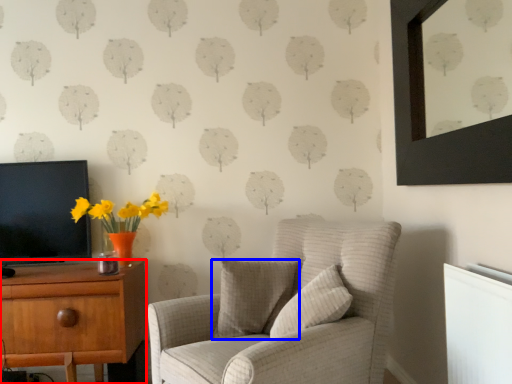
Question: Which point is closer to the camera, desk (highlighted by a red box) or pillow (highlighted by a blue box)?

Choices:
 (A) desk
 (B) pillow

Answer: (B)